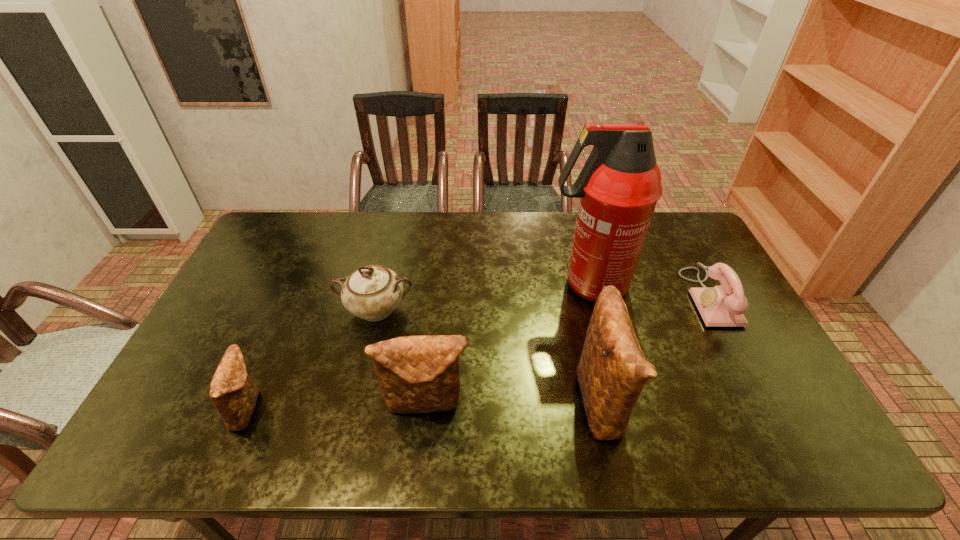
You are a GUI agent. You are given a task and a screenshot of the screen. Output one action in this format:
    pyautogui.click(x=<x>, y=<y>)
    Task: Click on the free space located on the trigger side of the tallest object
    This screenshot has height=540, width=960.
    Given the screenshot: What is the action you would take?
    pyautogui.click(x=492, y=285)

Where is `vacant space situated 0.200m on the trigger side of the tallest object`? The height and width of the screenshot is (540, 960). vacant space situated 0.200m on the trigger side of the tallest object is located at coordinates [x=482, y=285].

The image size is (960, 540). I want to click on free location located 0.340m on the trigger side of the tallest object, so click(438, 285).

Locate an element on the screen. This screenshot has width=960, height=540. blank space located 0.250m on the right of the chinaware is located at coordinates (499, 309).

You are a GUI agent. You are given a task and a screenshot of the screen. Output one action in this format:
    pyautogui.click(x=<x>, y=<y>)
    Task: Click on the free point located on the dial of the telephone
    The height and width of the screenshot is (540, 960).
    Given the screenshot: What is the action you would take?
    pyautogui.click(x=647, y=298)

The width and height of the screenshot is (960, 540). I want to click on vacant area located on the dial of the telephone, so click(x=598, y=298).

Image resolution: width=960 pixels, height=540 pixels. I want to click on free space located on the dial of the telephone, so click(578, 298).

Locate an element on the screen. The height and width of the screenshot is (540, 960). object present at the right edge is located at coordinates (722, 306).

This screenshot has height=540, width=960. I want to click on free space at the far edge, so click(x=359, y=220).

Locate an element on the screen. This screenshot has width=960, height=540. free space at the near edge is located at coordinates (523, 411).